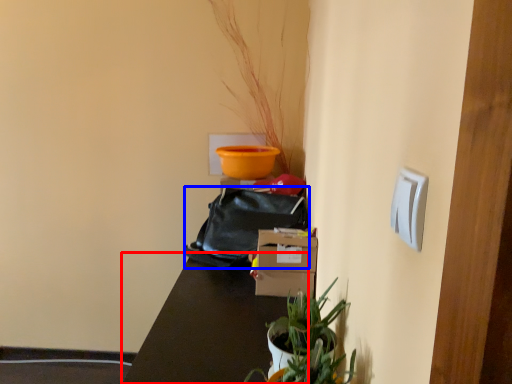
Question: Among these objects, which one is nearest to the camera, table (highlighted by a red box) or bag (highlighted by a blue box)?

Choices:
 (A) table
 (B) bag

Answer: (A)